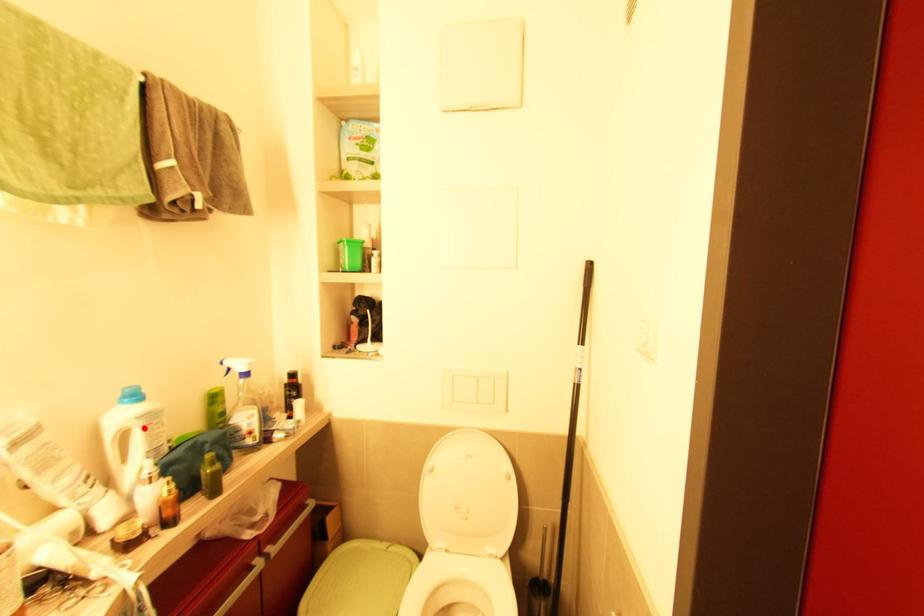
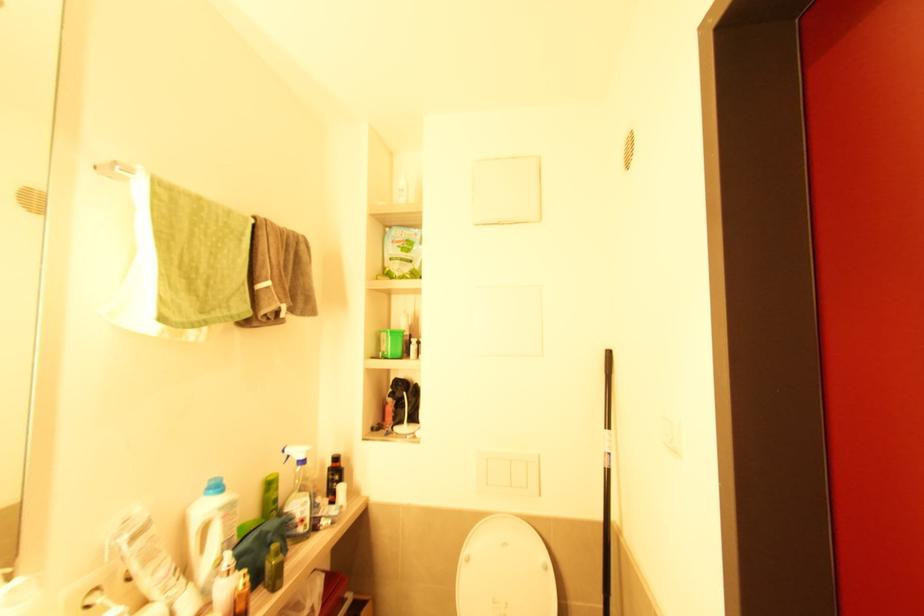
Where in the second image is the point corresponding to the highlighted location from the first image?

(224, 519)